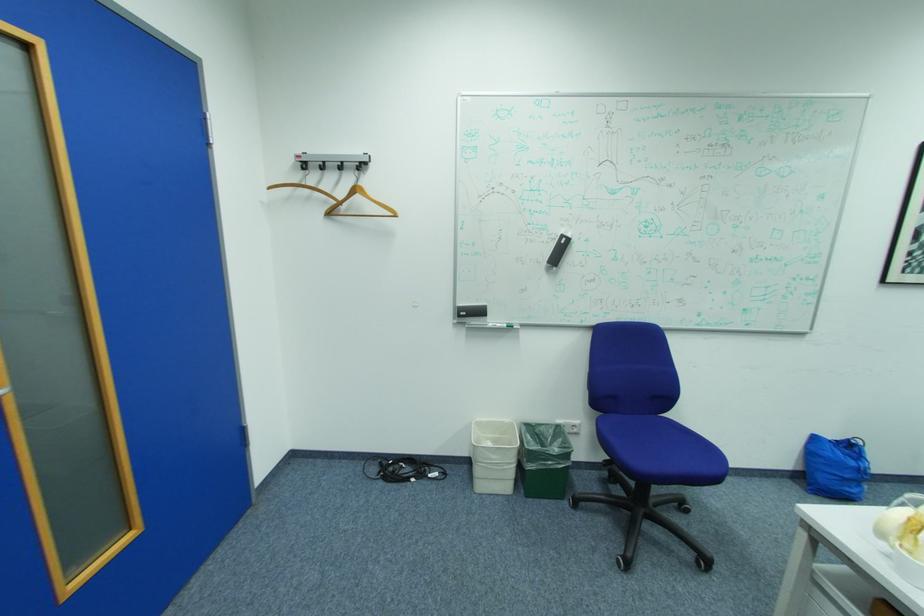
Where would you hang the coat rack hook? Please return your answer as a coordinate pair (x, y).

(337, 182)